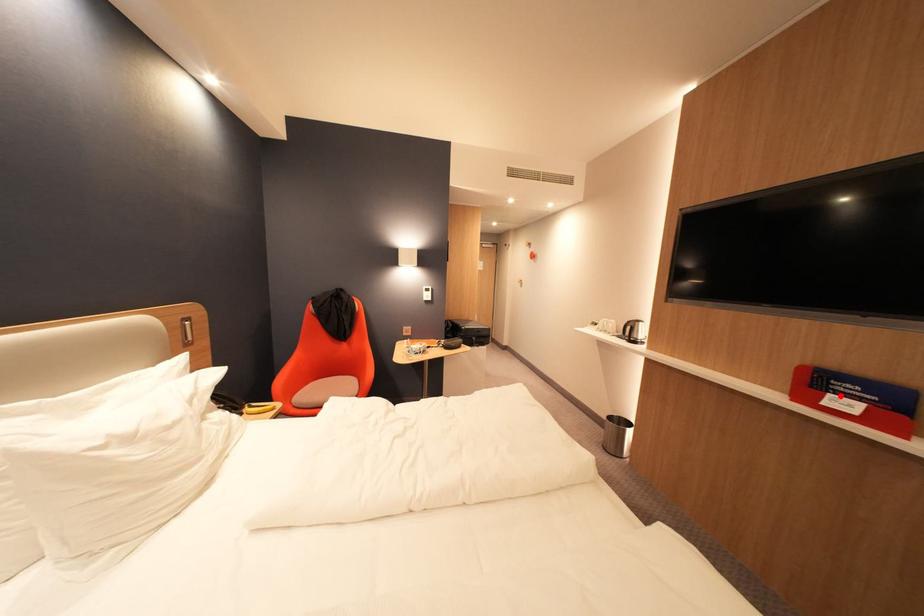
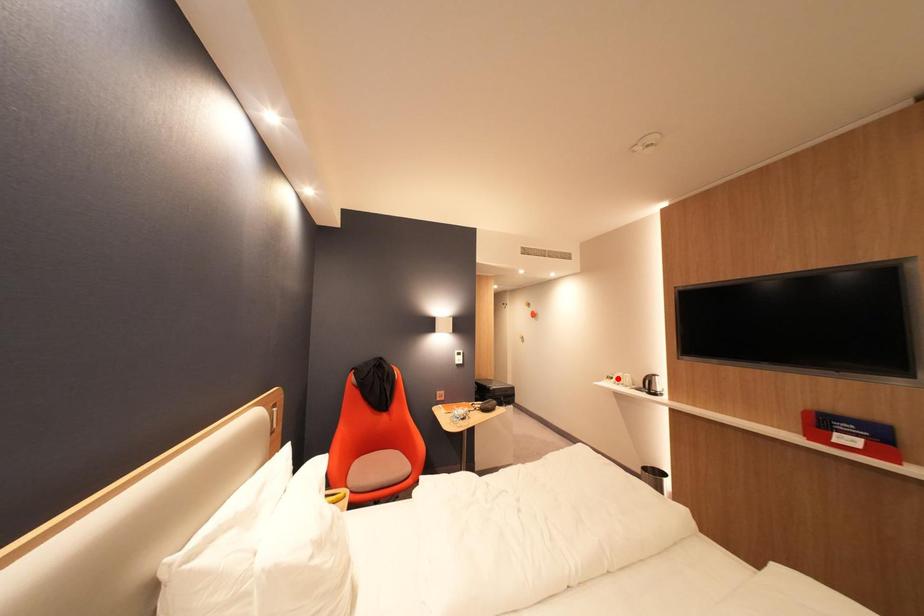
I am providing you with two images of the same scene from different viewpoints. A red point is marked on the first image and another point is marked on the second image. Do the highlighted points in image1 and image2 indicate the same real-world spot?

No